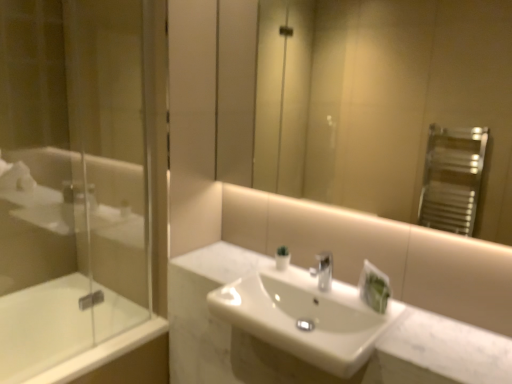
Question: Considering the relative sizes of matte glass mirror at upper center and white glossy bathtub at lower left in the image provided, is matte glass mirror at upper center shorter than white glossy bathtub at lower left?

Choices:
 (A) no
 (B) yes

Answer: (A)

Question: From a real-world perspective, is matte glass mirror at upper center over white glossy bathtub at lower left?

Choices:
 (A) no
 (B) yes

Answer: (B)

Question: Is matte glass mirror at upper center positioned before white glossy bathtub at lower left?

Choices:
 (A) no
 (B) yes

Answer: (B)

Question: Does matte glass mirror at upper center have a greater width compared to white glossy bathtub at lower left?

Choices:
 (A) yes
 (B) no

Answer: (B)

Question: Is white glossy bathtub at lower left inside matte glass mirror at upper center?

Choices:
 (A) no
 (B) yes

Answer: (A)

Question: Would you say matte glass mirror at upper center is outside white glossy bathtub at lower left?

Choices:
 (A) no
 (B) yes

Answer: (B)

Question: Does white glossy bathtub at lower left have a greater width compared to matte glass mirror at upper center?

Choices:
 (A) yes
 (B) no

Answer: (A)

Question: From a real-world perspective, does white glossy bathtub at lower left stand above matte glass mirror at upper center?

Choices:
 (A) yes
 (B) no

Answer: (B)

Question: From the image's perspective, would you say white glossy bathtub at lower left is positioned over matte glass mirror at upper center?

Choices:
 (A) yes
 (B) no

Answer: (B)

Question: Is white glossy bathtub at lower left positioned beyond the bounds of matte glass mirror at upper center?

Choices:
 (A) no
 (B) yes

Answer: (B)

Question: Does white glossy bathtub at lower left touch matte glass mirror at upper center?

Choices:
 (A) yes
 (B) no

Answer: (B)

Question: Does white glossy bathtub at lower left have a lesser width compared to matte glass mirror at upper center?

Choices:
 (A) yes
 (B) no

Answer: (B)

Question: Considering the relative positions of transparent glass shower door at left and white glossy bathtub at lower left in the image provided, is transparent glass shower door at left to the left of white glossy bathtub at lower left from the viewer's perspective?

Choices:
 (A) no
 (B) yes

Answer: (A)